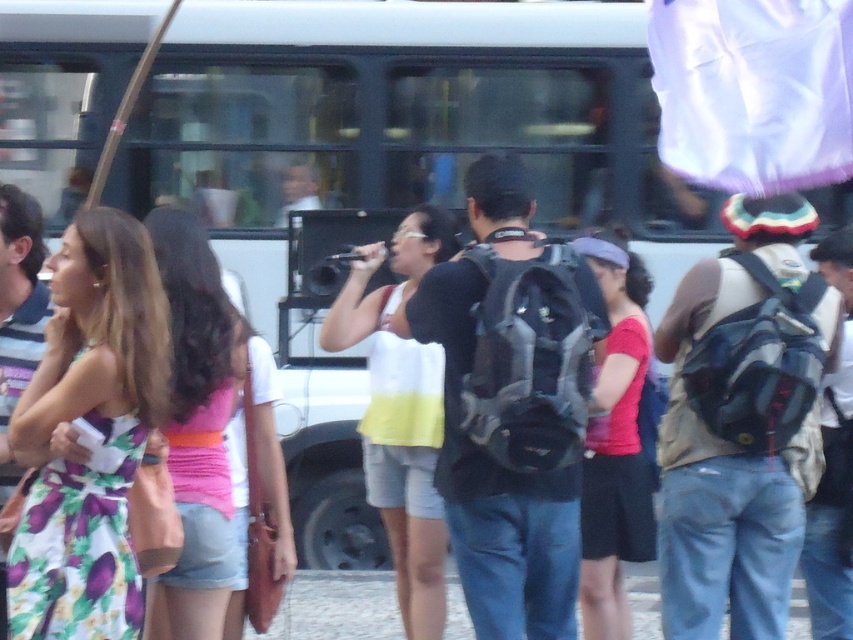
Which of these two, floral dress at left or matte red shirt at center, stands taller?

matte red shirt at center is taller.

Between floral dress at left and matte red shirt at center, which one is positioned lower?

matte red shirt at center is below.

Which is in front, point (109, 627) or point (634, 268)?

Positioned in front is point (109, 627).

You are a GUI agent. You are given a task and a screenshot of the screen. Output one action in this format:
    pyautogui.click(x=<x>, y=<y>)
    Task: Click on the floral dress at left
    Image resolution: width=853 pixels, height=640 pixels.
    Given the screenshot: What is the action you would take?
    pyautogui.click(x=93, y=428)

Is floral dress at left above pink fabric top at center?

Yes, floral dress at left is above pink fabric top at center.

Which is above, floral dress at left or pink fabric top at center?

Positioned higher is floral dress at left.

Find the location of a particular element. This screenshot has width=853, height=640. floral dress at left is located at coordinates (93, 428).

Who is shorter, pink fabric top at center or white cotton tank top at center?

With less height is pink fabric top at center.

Is pink fabric top at center further to the viewer compared to white cotton tank top at center?

That is False.

Is point (180, 579) closer to camera compared to point (366, 467)?

Yes, it is.

This screenshot has height=640, width=853. I want to click on pink fabric top at center, so click(x=198, y=428).